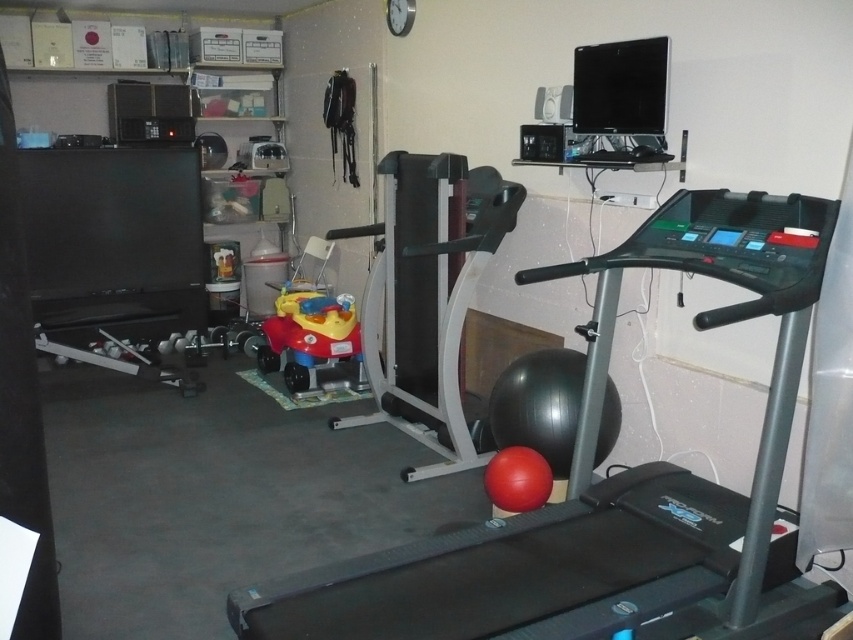
Based on the photo, is black rubber treadmill at center shorter than rubberized plastic toy car at center?

In fact, black rubber treadmill at center may be taller than rubberized plastic toy car at center.

Does black rubber treadmill at center have a larger size compared to rubberized plastic toy car at center?

Correct, black rubber treadmill at center is larger in size than rubberized plastic toy car at center.

Is point (764, 468) farther from viewer compared to point (312, 328)?

No, it is not.

The image size is (853, 640). Identify the location of black rubber treadmill at center. (612, 484).